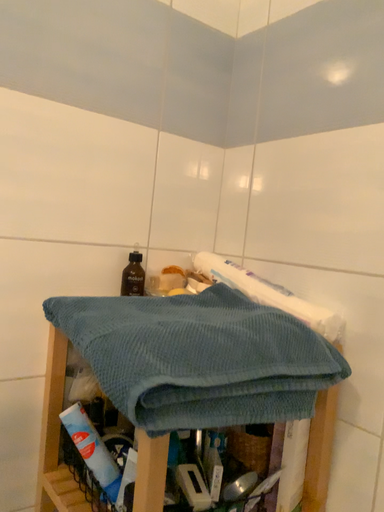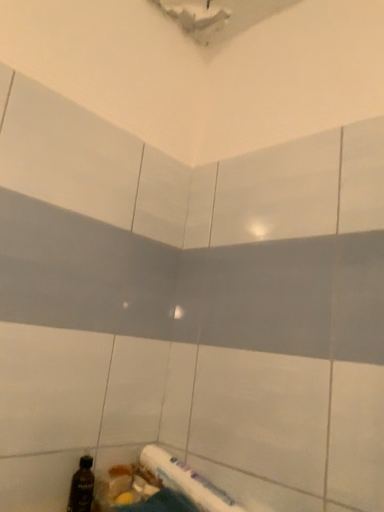
Question: How did the camera likely rotate when shooting the video?

Choices:
 (A) rotated upward
 (B) rotated downward

Answer: (A)